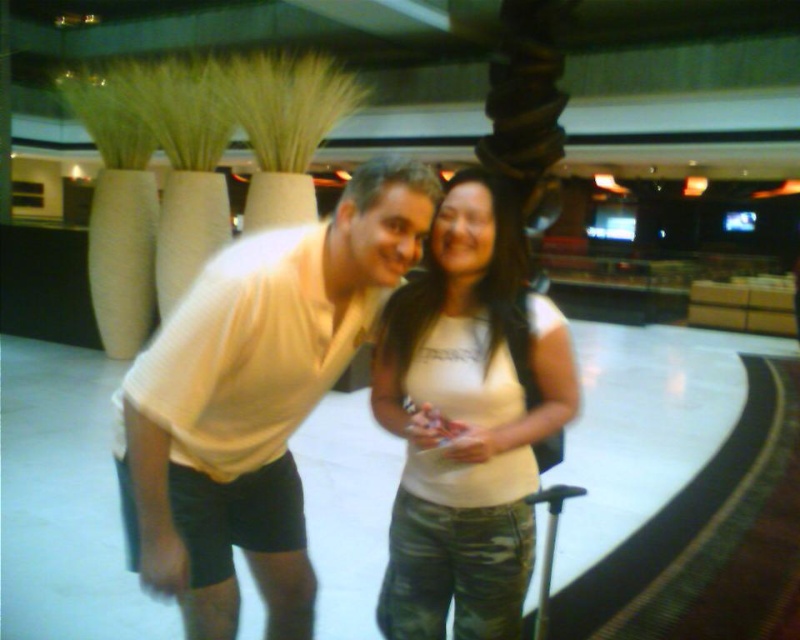
Is white matte shirt at center to the left of camouflage fabric suitcase at lower right from the viewer's perspective?

Yes, white matte shirt at center is to the left of camouflage fabric suitcase at lower right.

Between white matte shirt at center and camouflage fabric suitcase at lower right, which one is positioned lower?

camouflage fabric suitcase at lower right

Where is `white matte shirt at center`? white matte shirt at center is located at coordinates (256, 400).

In the scene shown: Can you confirm if white matte tank top at center is positioned to the right of camouflage fabric suitcase at lower right?

Incorrect, white matte tank top at center is not on the right side of camouflage fabric suitcase at lower right.

Looking at this image, who is more forward, (408, 353) or (548, 595)?

Positioned in front is point (408, 353).

Describe the element at coordinates (468, 419) in the screenshot. I see `white matte tank top at center` at that location.

Where is `white matte tank top at center`? This screenshot has height=640, width=800. white matte tank top at center is located at coordinates (468, 419).

Between white matte shirt at center and white matte tank top at center, which one appears on the right side from the viewer's perspective?

white matte tank top at center is more to the right.

Between white matte shirt at center and white matte tank top at center, which one has more height?

Standing taller between the two is white matte tank top at center.

Does point (296, 323) come in front of point (436, 396)?

Yes, it is in front of point (436, 396).

Where is `white matte shirt at center`? white matte shirt at center is located at coordinates (256, 400).